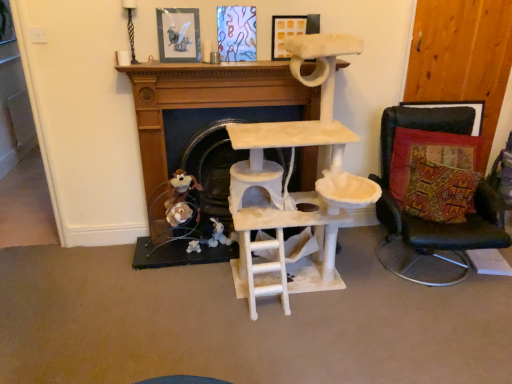
Question: Would you say matte glass picture frame at upper center, which is the 1th picture frame in left-to-right order, is inside or outside matte yellow picture frame at upper center, which is the 2th picture frame from left to right?

Choices:
 (A) inside
 (B) outside

Answer: (B)

Question: Is matte glass picture frame at upper center, which is the 1th picture frame in left-to-right order, in front of or behind matte yellow picture frame at upper center, placed as the 1th picture frame when sorted from right to left, in the image?

Choices:
 (A) behind
 (B) front

Answer: (B)

Question: Considering the real-world distances, which object is farthest from the black leather chair at right?

Choices:
 (A) multicolored woven cushion at right
 (B) fuzzy brown plush at lower center
 (C) beige fabric cat tree at center
 (D) matte glass picture frame at upper center, the 2th picture frame viewed from the right
 (E) matte yellow picture frame at upper center, which is the 2th picture frame from left to right

Answer: (D)

Question: Estimate the real-world distances between objects in this image. Which object is farther from the fuzzy brown plush at lower center?

Choices:
 (A) matte glass picture frame at upper center, which is the 1th picture frame in left-to-right order
 (B) multicolored woven cushion at right
 (C) matte yellow picture frame at upper center, which is the 2th picture frame from left to right
 (D) black leather chair at right
 (E) beige fabric cat tree at center

Answer: (D)